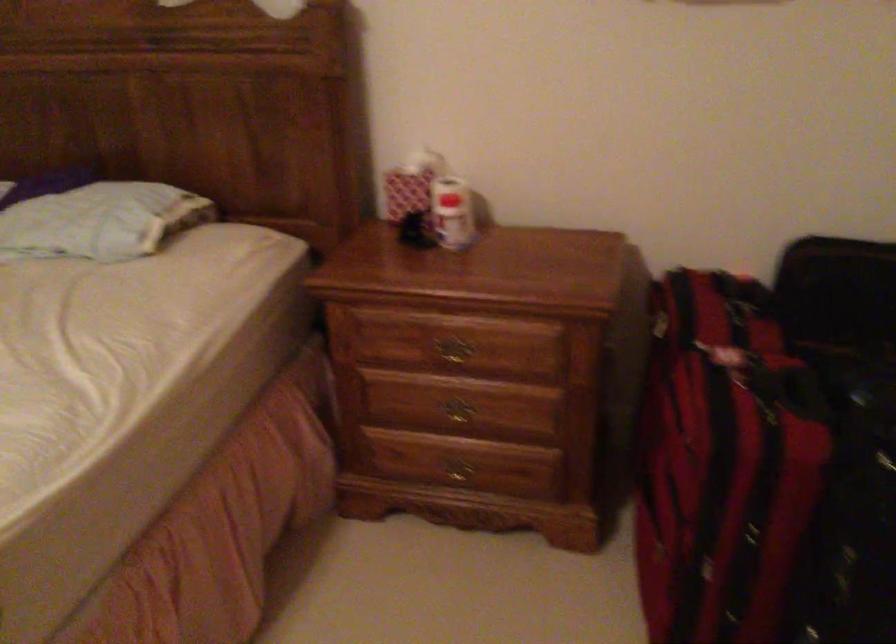
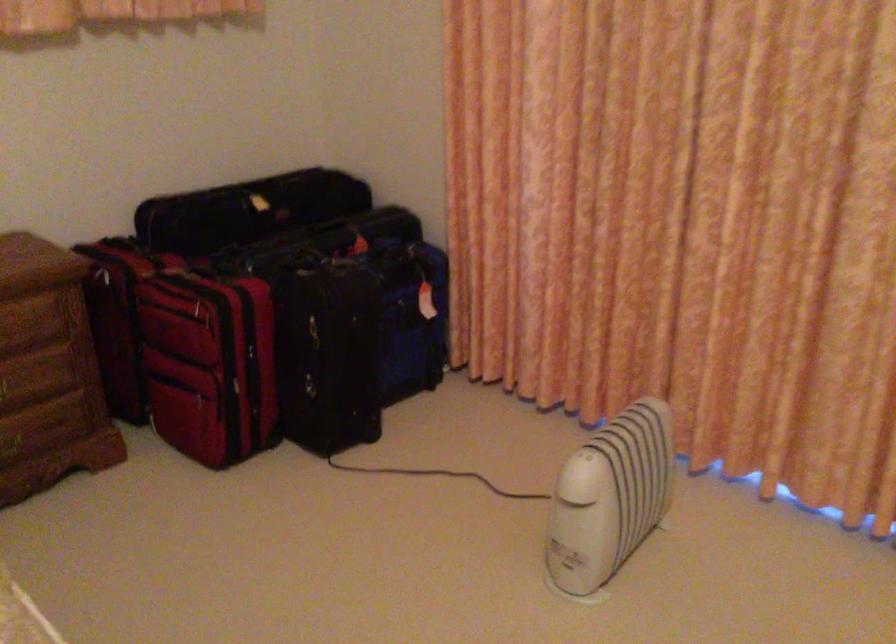
In the second image, find the point that corresponds to the point at 686,427 in the first image.

(202, 305)